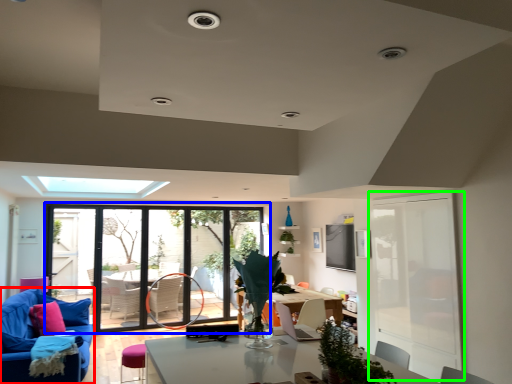
Question: Estimate the real-world distances between objects in this image. Which object is farther from studio couch (highlighted by a red box), window (highlighted by a blue box) or screen door (highlighted by a green box)?

Choices:
 (A) window
 (B) screen door

Answer: (B)